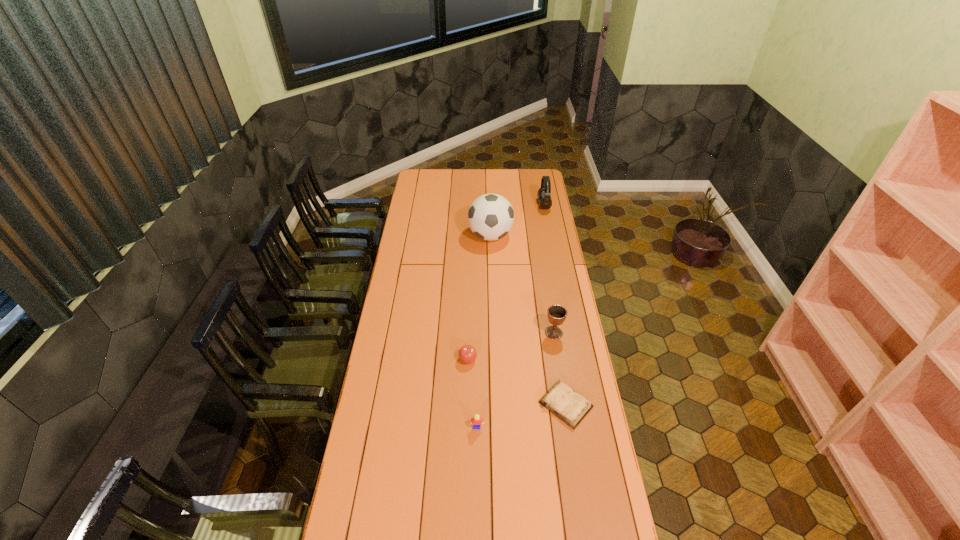
At what (x,y) coordinates should I click in order to perform the action: click on free space at the far edge of the desktop. Please return your answer as a coordinate pair (x, y). Image resolution: width=960 pixels, height=540 pixels. Looking at the image, I should click on (484, 171).

This screenshot has height=540, width=960. In the image, there is a desktop. What are the coordinates of `vacant space at the left edge` in the screenshot? It's located at (426, 209).

Locate an element on the screen. The width and height of the screenshot is (960, 540). blank space at the right edge is located at coordinates (571, 524).

In the image, there is a desktop. What are the coordinates of `vacant space at the far left corner` in the screenshot? It's located at (420, 187).

This screenshot has width=960, height=540. Find the location of `free space that is in between the Lego and the third farthest object`. free space that is in between the Lego and the third farthest object is located at coordinates coord(516,380).

The height and width of the screenshot is (540, 960). In order to click on empty location between the Lego and the shortest object in this screenshot , I will do `click(521, 416)`.

Where is `free space between the second tallest object and the third tallest object`? Image resolution: width=960 pixels, height=540 pixels. free space between the second tallest object and the third tallest object is located at coordinates (549, 269).

You are a GUI agent. You are given a task and a screenshot of the screen. Output one action in this format:
    pyautogui.click(x=<x>, y=<y>)
    Task: Click on the free space between the second tallest object and the chalice
    The image size is (960, 540).
    Given the screenshot: What is the action you would take?
    pyautogui.click(x=549, y=269)

The width and height of the screenshot is (960, 540). I want to click on free space between the Lego and the fourth farthest object, so click(x=472, y=393).

At what (x,y) coordinates should I click in order to perform the action: click on free area in between the shortest object and the tallest object. Please return your answer as a coordinate pair (x, y). The height and width of the screenshot is (540, 960). Looking at the image, I should click on [528, 320].